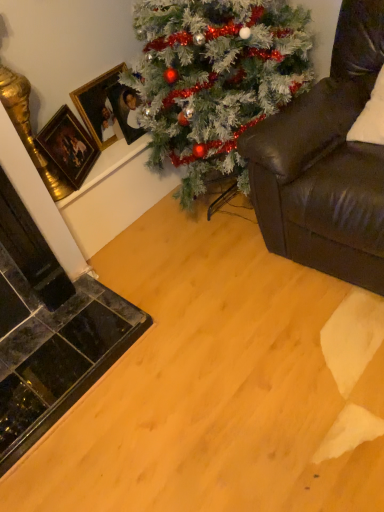
Question: From a real-world perspective, is green matte christmas tree at upper center positioned over gold-framed picture at upper left, the second picture frame positioned from the right, based on gravity?

Choices:
 (A) yes
 (B) no

Answer: (A)

Question: Can you confirm if green matte christmas tree at upper center is thinner than gold-framed picture at upper left, the second picture frame positioned from the right?

Choices:
 (A) yes
 (B) no

Answer: (B)

Question: Would you say green matte christmas tree at upper center is outside gold-framed picture at upper left, which ranks as the 2th picture frame in left-to-right order?

Choices:
 (A) no
 (B) yes

Answer: (B)

Question: Considering the relative positions of green matte christmas tree at upper center and gold-framed picture at upper left, the second picture frame positioned from the right, in the image provided, is green matte christmas tree at upper center to the left of gold-framed picture at upper left, the second picture frame positioned from the right, from the viewer's perspective?

Choices:
 (A) no
 (B) yes

Answer: (A)

Question: Would you say green matte christmas tree at upper center is a long distance from gold-framed picture at upper left, the second picture frame positioned from the right?

Choices:
 (A) no
 (B) yes

Answer: (A)

Question: Does green matte christmas tree at upper center appear on the right side of gold-framed picture at upper left, the second picture frame positioned from the right?

Choices:
 (A) yes
 (B) no

Answer: (A)

Question: Considering the relative sizes of gold-framed picture at upper left, the second picture frame positioned from the right, and leather couch at right in the image provided, is gold-framed picture at upper left, the second picture frame positioned from the right, thinner than leather couch at right?

Choices:
 (A) no
 (B) yes

Answer: (B)

Question: Is gold-framed picture at upper left, which ranks as the 2th picture frame in left-to-right order, not close to leather couch at right?

Choices:
 (A) yes
 (B) no

Answer: (B)

Question: Is gold-framed picture at upper left, the second picture frame positioned from the right, not within leather couch at right?

Choices:
 (A) no
 (B) yes

Answer: (B)

Question: Does gold-framed picture at upper left, the second picture frame positioned from the right, have a greater width compared to leather couch at right?

Choices:
 (A) no
 (B) yes

Answer: (A)

Question: Is gold-framed picture at upper left, which ranks as the 2th picture frame in left-to-right order, behind leather couch at right?

Choices:
 (A) no
 (B) yes

Answer: (B)

Question: From a real-world perspective, is gold-framed picture at upper left, the second picture frame positioned from the right, on leather couch at right?

Choices:
 (A) no
 (B) yes

Answer: (B)

Question: Can you confirm if green matte christmas tree at upper center is wider than leather couch at right?

Choices:
 (A) yes
 (B) no

Answer: (B)